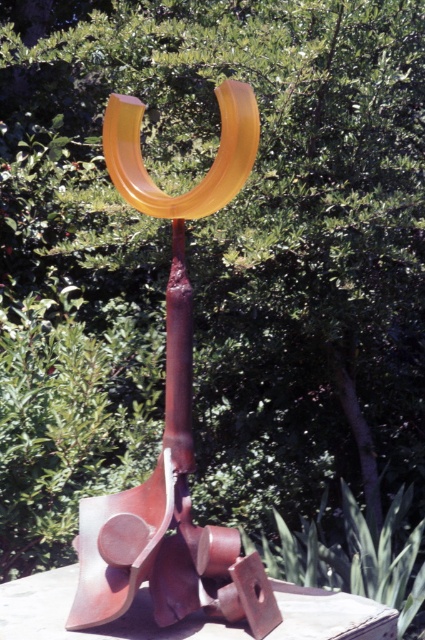
Question: Does matte yellow metal sculpture at center appear on the left side of translucent amber horseshoe at center?

Choices:
 (A) yes
 (B) no

Answer: (A)

Question: Does matte yellow metal sculpture at center have a smaller size compared to translucent amber horseshoe at center?

Choices:
 (A) yes
 (B) no

Answer: (B)

Question: Estimate the real-world distances between objects in this image. Which object is farther from the rusty metal sculpture at center?

Choices:
 (A) matte yellow metal sculpture at center
 (B) translucent amber horseshoe at center

Answer: (B)

Question: Which object is the farthest from the translucent amber horseshoe at center?

Choices:
 (A) matte yellow metal sculpture at center
 (B) rusty metal sculpture at center

Answer: (B)

Question: Which object is positioned farthest from the rusty metal sculpture at center?

Choices:
 (A) translucent amber horseshoe at center
 (B) matte yellow metal sculpture at center

Answer: (A)

Question: Does matte yellow metal sculpture at center appear over rusty metal sculpture at center?

Choices:
 (A) yes
 (B) no

Answer: (A)